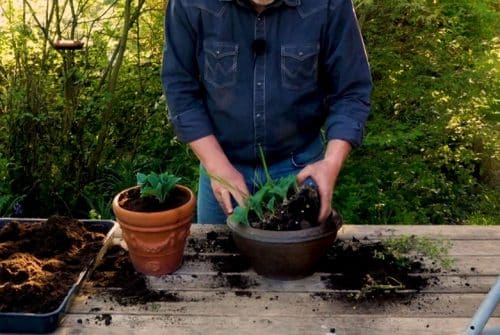
Locate an element on the screen. The image size is (500, 335). pot is located at coordinates (159, 241).